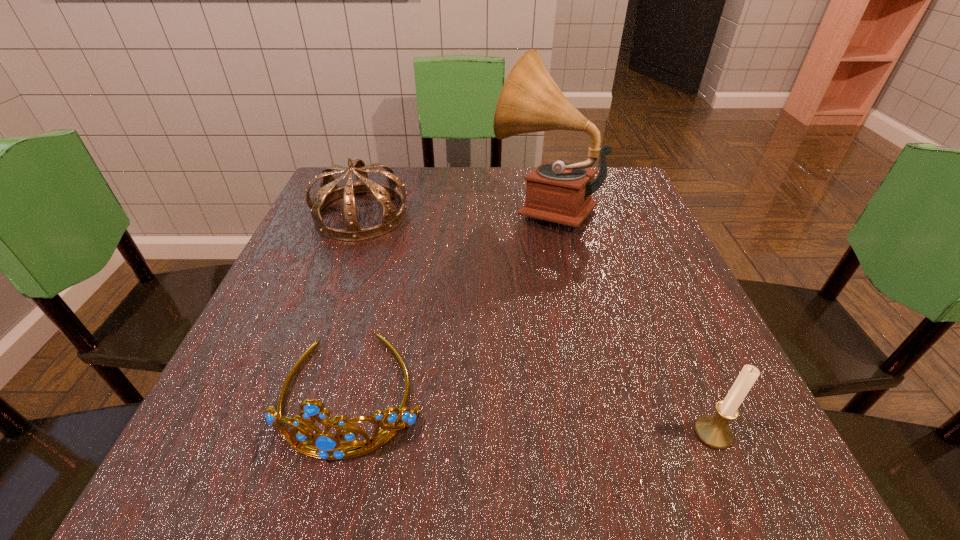
At what (x,y) coordinates should I click in order to perform the action: click on vacant area that lies between the rightmost object and the farther tiara. Please return your answer as a coordinate pair (x, y). The width and height of the screenshot is (960, 540). Looking at the image, I should click on (537, 324).

Find the location of a particular element. This screenshot has width=960, height=540. vacant space in between the rightmost object and the farther tiara is located at coordinates (537, 324).

This screenshot has width=960, height=540. I want to click on vacant space in between the candle holder and the farther tiara, so click(537, 324).

Locate an element on the screen. The image size is (960, 540). vacant area that lies between the phonograph record and the rightmost object is located at coordinates (628, 319).

Where is `blank region between the second object from right to left and the candle holder`? This screenshot has width=960, height=540. blank region between the second object from right to left and the candle holder is located at coordinates (628, 319).

Locate an element on the screen. This screenshot has height=540, width=960. blank region between the nearer tiara and the farther tiara is located at coordinates (356, 304).

You are a GUI agent. You are given a task and a screenshot of the screen. Output one action in this format:
    pyautogui.click(x=<x>, y=<y>)
    Task: Click on the closest object to the farther tiara
    This screenshot has height=540, width=960.
    Given the screenshot: What is the action you would take?
    pyautogui.click(x=530, y=101)

Point out which object is positioned as the second nearest to the nearer tiara. Please provide its 2D coordinates. Your answer should be formatted as a tuple, i.e. [(x, y)], where the tuple contains the x and y coordinates of a point satisfying the conditions above.

[(530, 101)]

Find the location of a particular element. vacant space that satisfies the following two spatial constraints: 1. on the horn of the candle holder; 2. on the right side of the phonograph record is located at coordinates (589, 433).

This screenshot has width=960, height=540. I want to click on vacant space that satisfies the following two spatial constraints: 1. on the horn of the second object from right to left; 2. on the front-facing side of the nearer tiara, so click(581, 393).